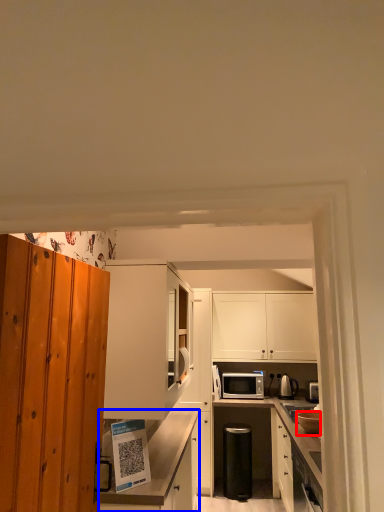
Question: Which object is closer to the camera taking this photo, appliance (highlighted by a red box) or cabinetry (highlighted by a blue box)?

Choices:
 (A) appliance
 (B) cabinetry

Answer: (B)